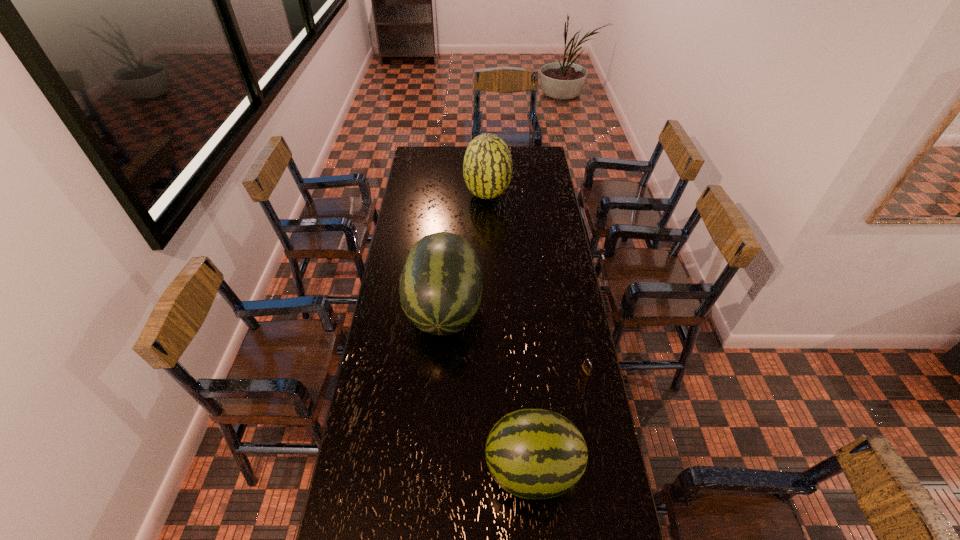
Select which object appears as the third closest to the second farthest watermelon. Please provide its 2D coordinates. Your answer should be formatted as a tuple, i.e. [(x, y)], where the tuple contains the x and y coordinates of a point satisfying the conditions above.

[(487, 167)]

Locate an element on the screen. This screenshot has height=540, width=960. object that is the closest to the rightmost object is located at coordinates (531, 453).

Identify which watermelon is the second closest to the shortest watermelon. Please provide its 2D coordinates. Your answer should be formatted as a tuple, i.e. [(x, y)], where the tuple contains the x and y coordinates of a point satisfying the conditions above.

[(487, 167)]

At what (x,y) coordinates should I click in order to perform the action: click on watermelon that is the second closest to the second farthest object. Please return your answer as a coordinate pair (x, y). Looking at the image, I should click on (487, 167).

Find the location of a particular element. blank space that satisfies the following two spatial constraints: 1. on the front side of the padlock; 2. at the stem end of the nearest watermelon is located at coordinates (601, 469).